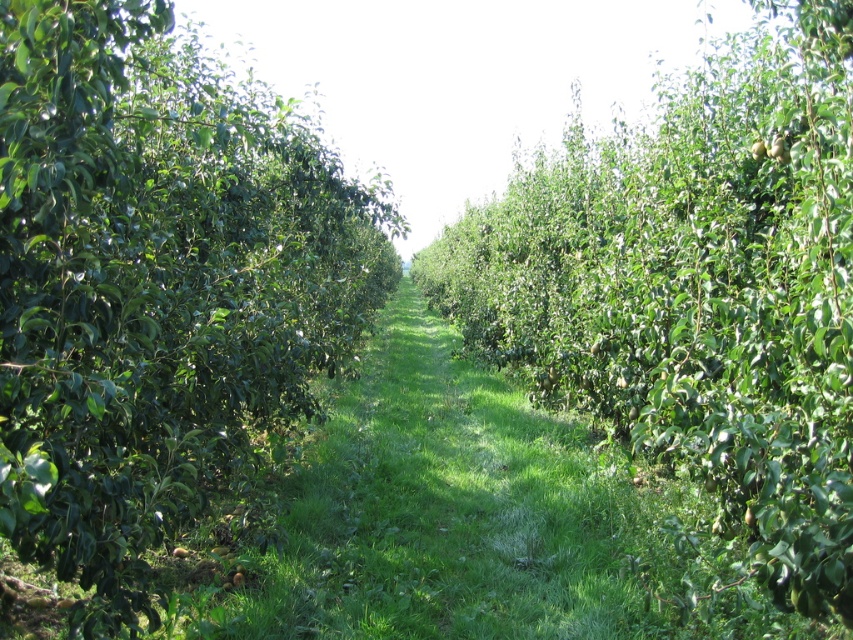
You are a gardener standing in the orchard and want to water the green grass at center. However, your watering can is currently under the green glossy tree at left. Can you easily reach the watering can from your current position?

The green glossy tree at left is located above the green grass at center, so the watering can under the green glossy tree at left is accessible from the green grass at center. Yes, you can easily reach the watering can.

You are standing at the center of the orchard aisle and notice a green glossy tree at left. Where exactly is this tree positioned relative to your current location?

The green glossy tree at left is located at point 0.448 along the horizontal axis and 0.182 along the vertical axis relative to your position at the center of the orchard aisle.

You are walking along the orchard aisle and want to pick fruits from both the green glossy tree at left and the green leafy tree at center. Which tree should you approach first to reach the closer one?

You should approach the green glossy tree at left first because it is closer to you than the green leafy tree at center.